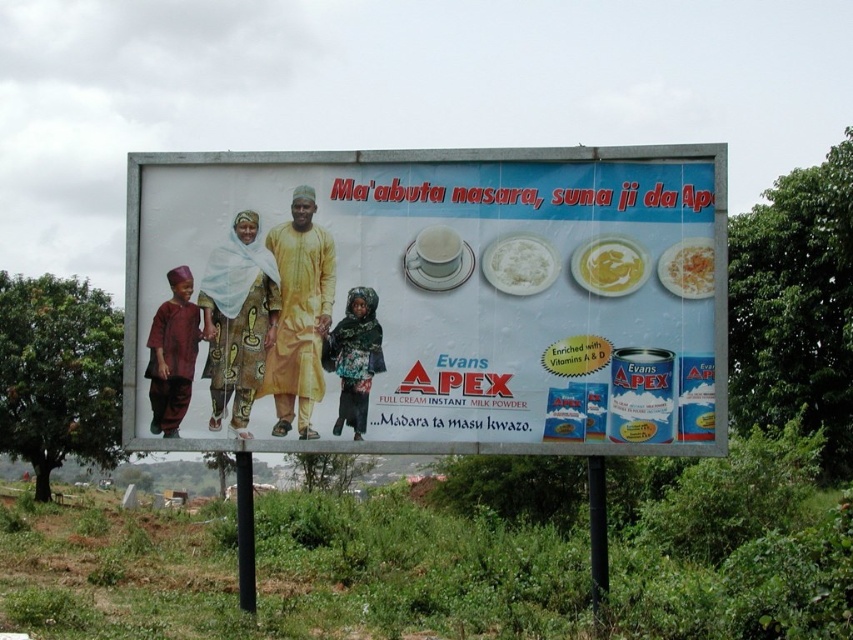
Is smooth yellow rice at center thinner than yellow creamy sauce at upper center?

Yes.

Does smooth yellow rice at center have a greater width compared to yellow creamy sauce at upper center?

No.

Find the location of a particular element. smooth yellow rice at center is located at coordinates (688, 268).

The width and height of the screenshot is (853, 640). In order to click on smooth yellow rice at center in this screenshot , I will do `click(688, 268)`.

Does matte yellow fabric at center come in front of smooth yellow rice at center?

That is True.

Does matte yellow fabric at center have a lesser width compared to smooth yellow rice at center?

In fact, matte yellow fabric at center might be wider than smooth yellow rice at center.

Between point (428, 448) and point (679, 296), which one is positioned in front?

Positioned in front is point (679, 296).

Locate an element on the screen. The width and height of the screenshot is (853, 640). matte yellow fabric at center is located at coordinates (419, 301).

Does matte yellow fabric at center have a smaller size compared to white powder at upper center?

No, matte yellow fabric at center is not smaller than white powder at upper center.

The width and height of the screenshot is (853, 640). Describe the element at coordinates (419, 301) in the screenshot. I see `matte yellow fabric at center` at that location.

You are a GUI agent. You are given a task and a screenshot of the screen. Output one action in this format:
    pyautogui.click(x=<x>, y=<y>)
    Task: Click on the matte yellow fabric at center
    The image size is (853, 640).
    Given the screenshot: What is the action you would take?
    pyautogui.click(x=419, y=301)